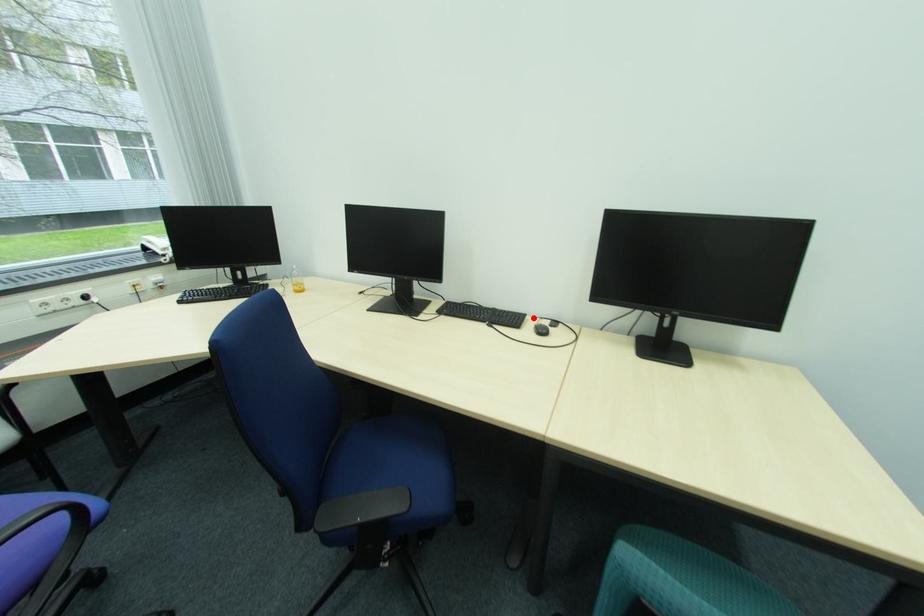
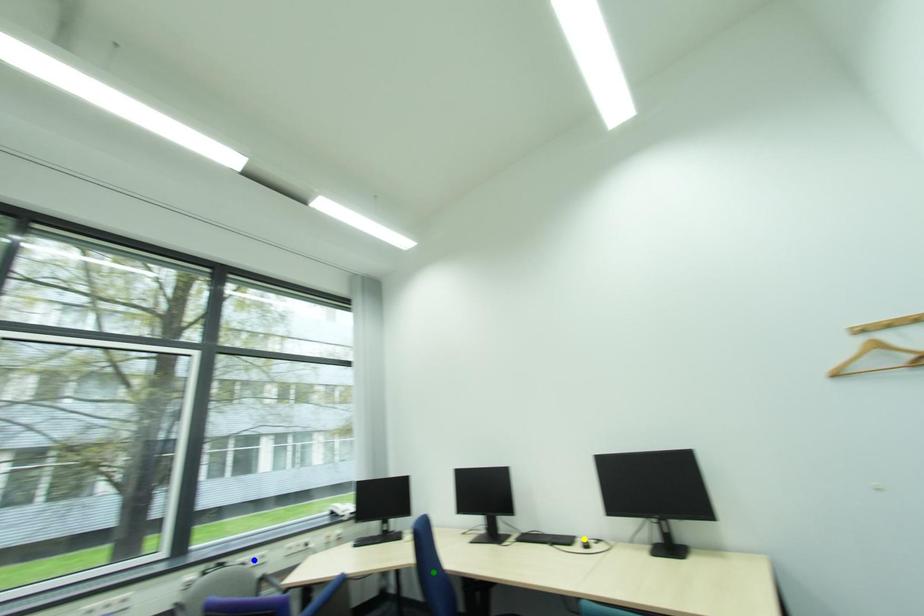
Question: I am providing you with two images of the same scene from different viewpoints. A red point is marked on the first image. You are given multiple points on the second image. Can you choose the point in image 2 that corresponds to the point in image 1?

Choices:
 (A) blue point
 (B) yellow point
 (C) green point

Answer: (B)